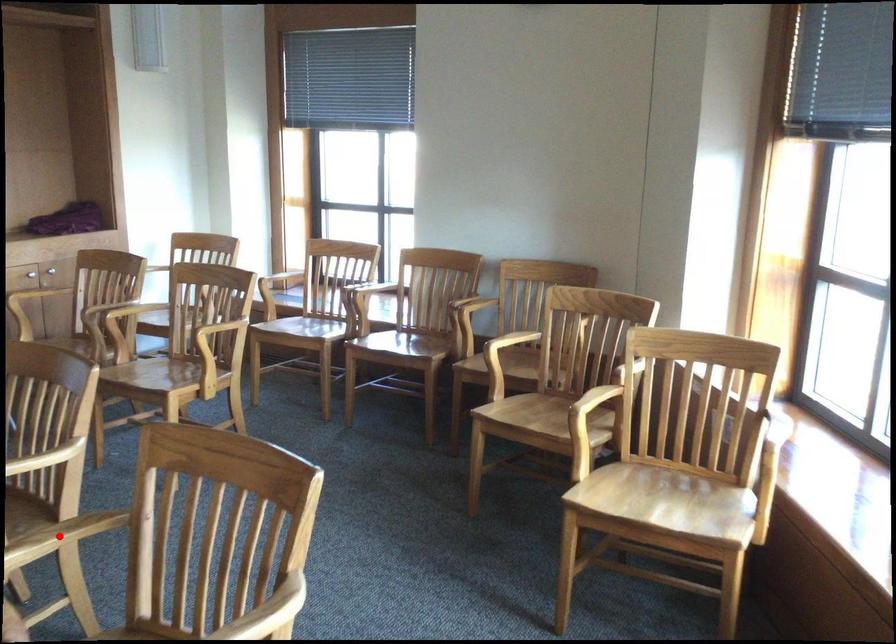
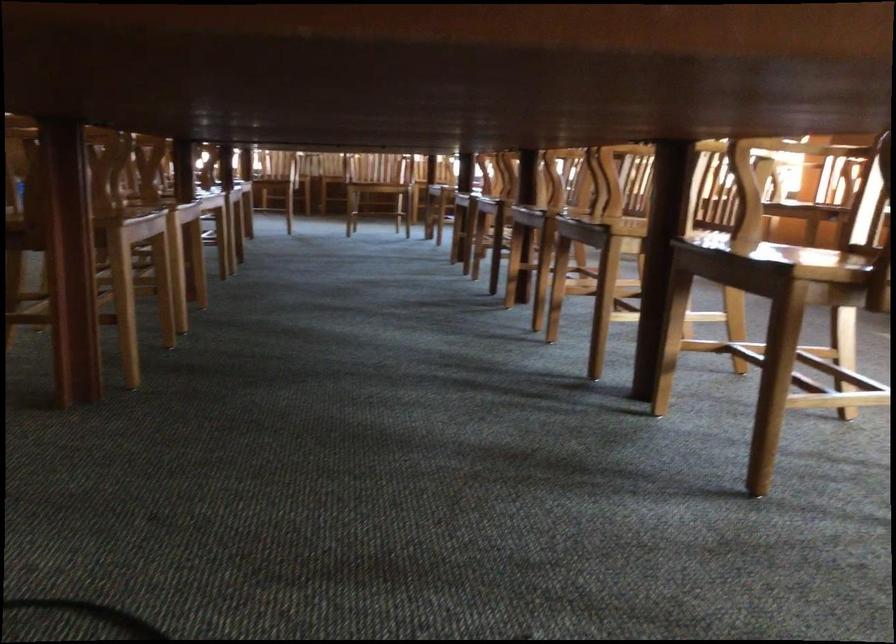
Question: I am providing you with two images of the same scene from different viewpoints. A red point is marked on the first image. At the location where the point appears in image 1, is it still visible in image 2?

Choices:
 (A) Yes
 (B) No

Answer: (B)